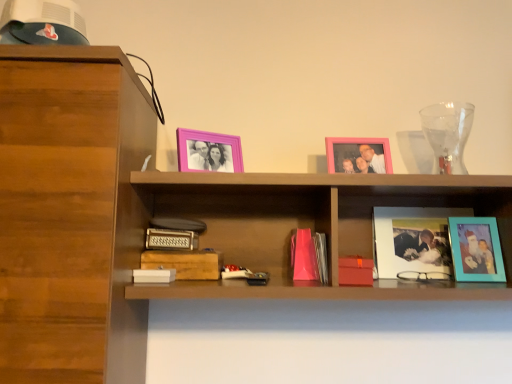
Question: Can you confirm if matte glass photo frame at center right, which is counted as the second picture frame, starting from the right, is shorter than transparent glass vase at upper right?

Choices:
 (A) yes
 (B) no

Answer: (A)

Question: Is transparent glass vase at upper right at the back of matte glass photo frame at center right, which is counted as the second picture frame, starting from the right?

Choices:
 (A) yes
 (B) no

Answer: (B)

Question: From a real-world perspective, is matte glass photo frame at center right, which is counted as the second picture frame, starting from the right, physically above transparent glass vase at upper right?

Choices:
 (A) no
 (B) yes

Answer: (A)

Question: Could you tell me if matte glass photo frame at center right, which is counted as the second picture frame, starting from the right, is facing transparent glass vase at upper right?

Choices:
 (A) no
 (B) yes

Answer: (A)

Question: Considering the relative positions of matte glass photo frame at center right, which is counted as the second picture frame, starting from the right, and transparent glass vase at upper right in the image provided, is matte glass photo frame at center right, which is counted as the second picture frame, starting from the right, to the right of transparent glass vase at upper right from the viewer's perspective?

Choices:
 (A) no
 (B) yes

Answer: (A)

Question: From the image's perspective, is matte glass photo frame at center right, which is counted as the second picture frame, starting from the right, above or below teal matte picture frame at right, the fourth picture frame positioned from the left?

Choices:
 (A) above
 (B) below

Answer: (A)

Question: Is point (386, 223) positioned closer to the camera than point (458, 271)?

Choices:
 (A) farther
 (B) closer

Answer: (A)

Question: Do you think matte glass photo frame at center right, which is counted as the second picture frame, starting from the right, is within teal matte picture frame at right, the fourth picture frame positioned from the left, or outside of it?

Choices:
 (A) inside
 (B) outside

Answer: (B)

Question: Is matte glass photo frame at center right, which is counted as the second picture frame, starting from the right, taller or shorter than teal matte picture frame at right, the first picture frame from the right?

Choices:
 (A) tall
 (B) short

Answer: (A)

Question: Considering the positions of point (220, 258) and point (53, 49), is point (220, 258) closer or farther from the camera than point (53, 49)?

Choices:
 (A) closer
 (B) farther

Answer: (B)

Question: Is wooden paperback book at center, which is counted as the 2th paperback book, starting from the right, taller or shorter than wooden cabinet at left?

Choices:
 (A) tall
 (B) short

Answer: (B)

Question: In the image, is wooden paperback book at center, marked as the 3th paperback book in a left-to-right arrangement, on the left side or the right side of wooden cabinet at left?

Choices:
 (A) left
 (B) right

Answer: (B)

Question: Is wooden paperback book at center, which is counted as the 2th paperback book, starting from the right, wider or thinner than wooden cabinet at left?

Choices:
 (A) thin
 (B) wide

Answer: (A)

Question: From the image's perspective, relative to matte red paperback book at center, arranged as the 4th paperback book when viewed from the left, is matte glass photo frame at center right, which is counted as the second picture frame, starting from the right, above or below?

Choices:
 (A) above
 (B) below

Answer: (A)

Question: Does point (417, 246) appear closer or farther from the camera than point (369, 283)?

Choices:
 (A) farther
 (B) closer

Answer: (A)